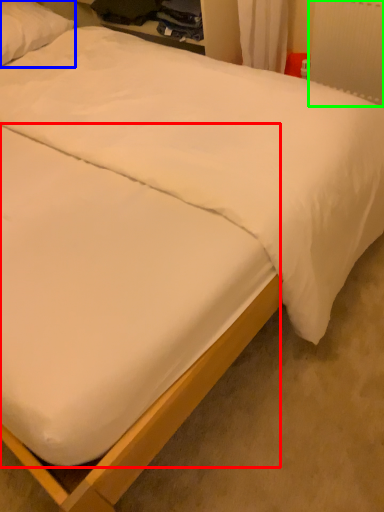
Question: Based on their relative distances, which object is nearer to mattress (highlighted by a red box)? Choose from pillow (highlighted by a blue box) and radiator (highlighted by a green box).

Choices:
 (A) pillow
 (B) radiator

Answer: (B)